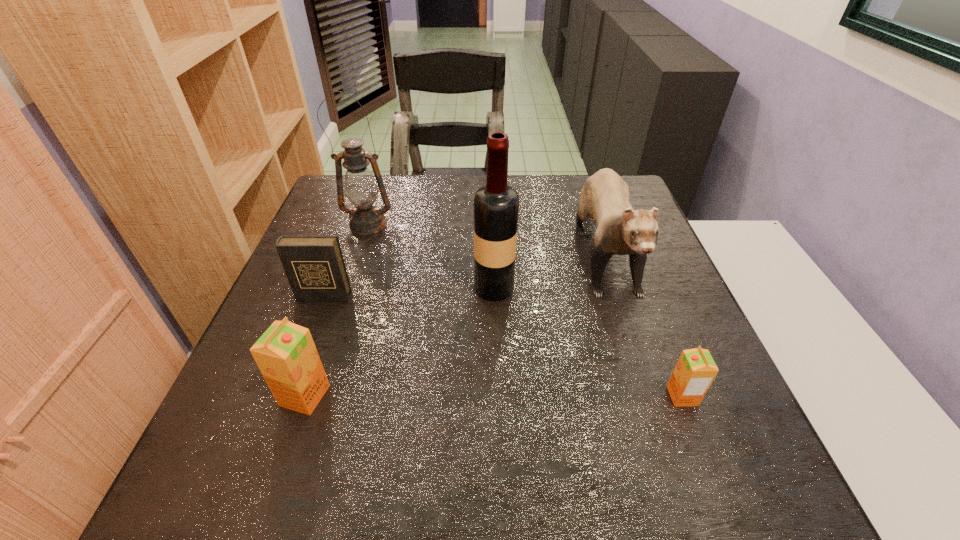
Image resolution: width=960 pixels, height=540 pixels. In order to click on object that is the third closest to the taller orange juice in this screenshot , I will do [361, 189].

Identify which object is the fifth nearest to the fourth shortest object. Please provide its 2D coordinates. Your answer should be formatted as a tuple, i.e. [(x, y)], where the tuple contains the x and y coordinates of a point satisfying the conditions above.

[(286, 355)]

Locate an element on the screen. The height and width of the screenshot is (540, 960). free point that satisfies the following two spatial constraints: 1. on the front cover of the diary; 2. on the left side of the right orange juice is located at coordinates (286, 396).

This screenshot has height=540, width=960. In order to click on vacant region that satisfies the following two spatial constraints: 1. on the front cover of the right orange juice; 2. on the left side of the second shortest object in this screenshot , I will do `click(286, 396)`.

Find the location of a particular element. vacant point that satisfies the following two spatial constraints: 1. on the front cover of the diary; 2. on the left side of the left orange juice is located at coordinates (286, 396).